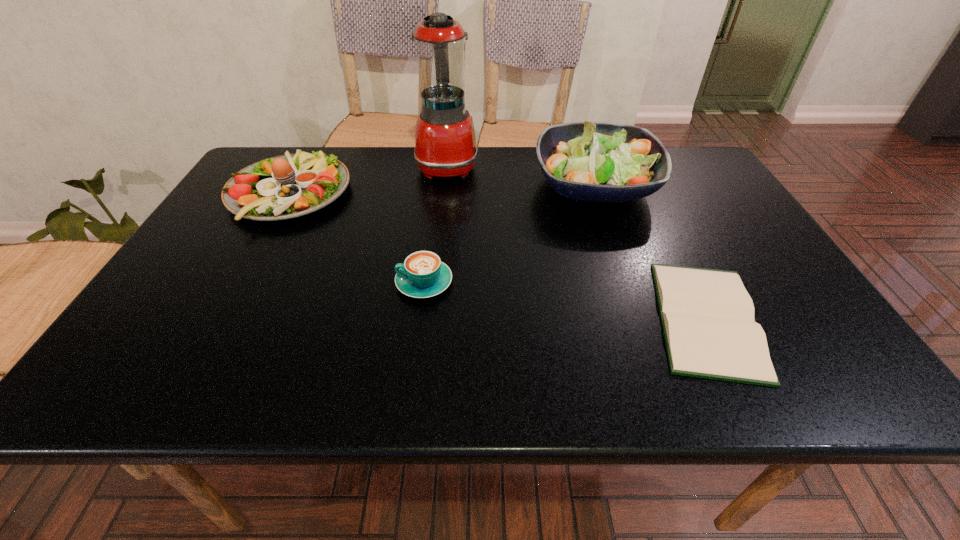
The width and height of the screenshot is (960, 540). In order to click on free region located 0.340m with the handle on the right side of the fourth tallest object in this screenshot , I will do `click(243, 282)`.

Where is `free space located with the handle on the right side of the fourth tallest object`? free space located with the handle on the right side of the fourth tallest object is located at coordinates (355, 282).

Where is `vacant space situated with the handle on the right side of the fourth tallest object`? This screenshot has width=960, height=540. vacant space situated with the handle on the right side of the fourth tallest object is located at coordinates tap(351, 282).

The width and height of the screenshot is (960, 540). Identify the location of free space located 0.280m on the back of the shortest object. (648, 197).

Find the location of `food processor that is at the far edge`. food processor that is at the far edge is located at coordinates (445, 143).

Find the location of a particular element. This screenshot has height=540, width=960. object at the near edge is located at coordinates (707, 315).

Where is `object that is at the left edge`? The width and height of the screenshot is (960, 540). object that is at the left edge is located at coordinates (291, 185).

You are a GUI agent. You are given a task and a screenshot of the screen. Output one action in this format:
    pyautogui.click(x=<x>, y=<y>)
    Task: Click on the object that is at the right edge
    The image size is (960, 540).
    Given the screenshot: What is the action you would take?
    pyautogui.click(x=707, y=315)

Image resolution: width=960 pixels, height=540 pixels. I want to click on object at the far left corner, so click(x=291, y=185).

Identify the location of object present at the near right corner. (707, 315).